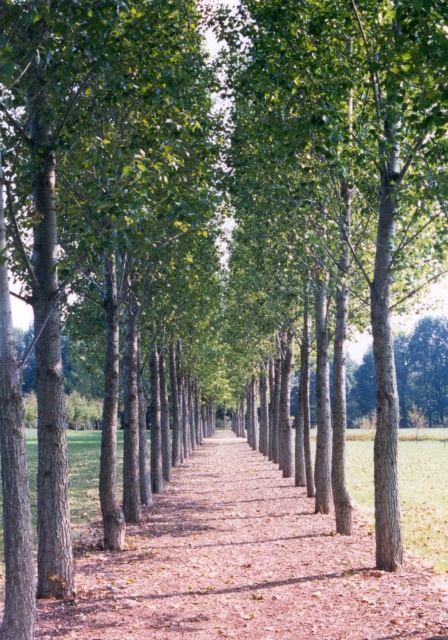
Question: Considering the relative positions of smooth bark tree at center and brown bark path at center in the image provided, where is smooth bark tree at center located with respect to brown bark path at center?

Choices:
 (A) left
 (B) right

Answer: (B)

Question: Which of the following is the closest to the observer?

Choices:
 (A) (284, 72)
 (B) (301, 605)

Answer: (B)

Question: Is smooth bark tree at center to the right of brown bark path at center from the viewer's perspective?

Choices:
 (A) yes
 (B) no

Answer: (A)

Question: Is smooth bark tree at center positioned in front of brown bark path at center?

Choices:
 (A) yes
 (B) no

Answer: (A)

Question: Which point is farther from the camera taking this photo?

Choices:
 (A) (374, 268)
 (B) (199, 614)

Answer: (A)